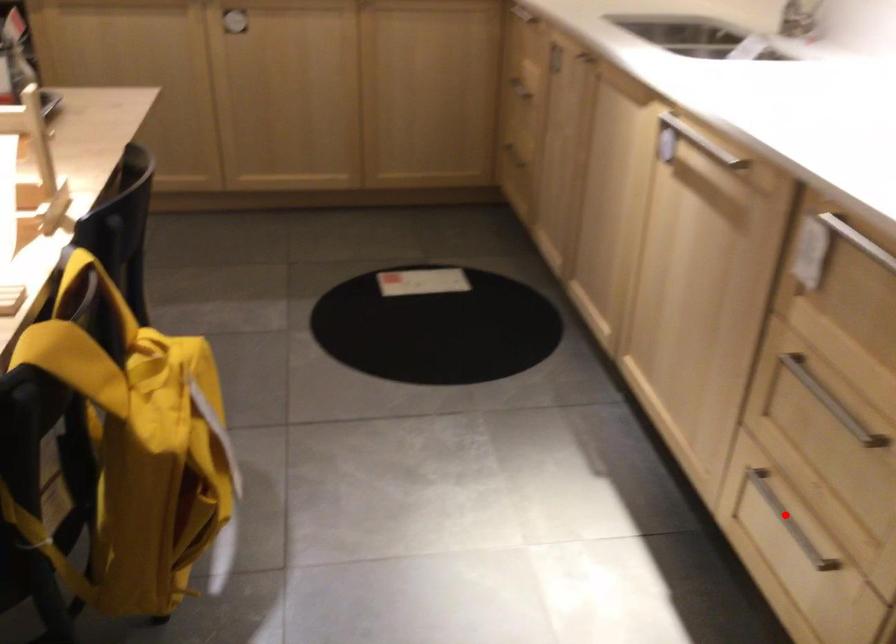
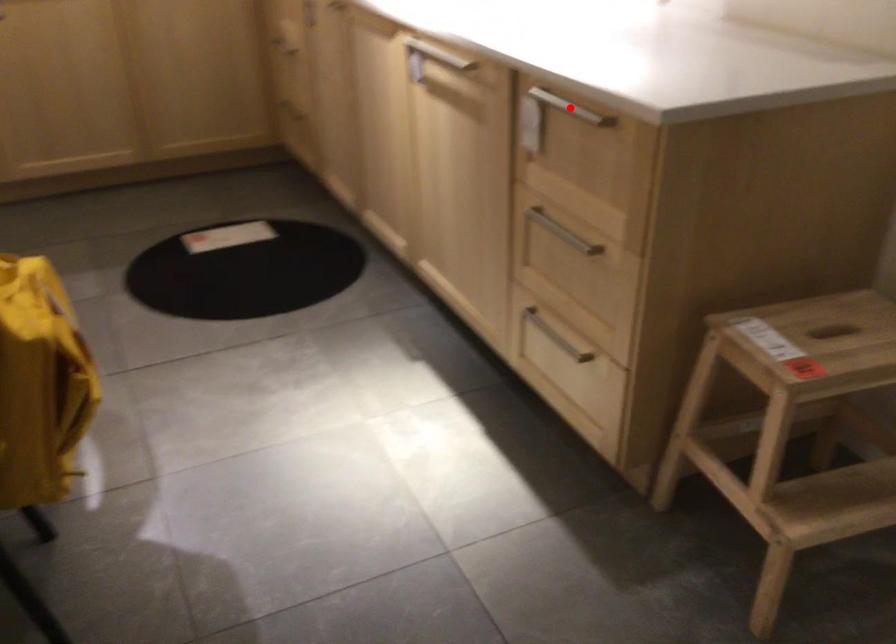
I am providing you with two images of the same scene from different viewpoints. A red point is marked on the first image and another point is marked on the second image. Does the point marked in image1 correspond to the same location as the one in image2?

No